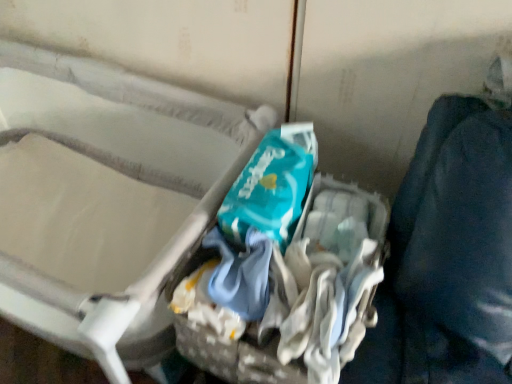
Question: Is point (378, 223) positioned closer to the camera than point (146, 175)?

Choices:
 (A) farther
 (B) closer

Answer: (B)

Question: From a real-world perspective, is teal fabric bag at center physically located above or below white fabric crib at upper left?

Choices:
 (A) below
 (B) above

Answer: (B)

Question: In terms of size, does teal fabric bag at center appear bigger or smaller than white fabric crib at upper left?

Choices:
 (A) big
 (B) small

Answer: (B)

Question: Is white fabric crib at upper left in front of or behind teal fabric bag at center in the image?

Choices:
 (A) behind
 (B) front

Answer: (B)

Question: From a real-world perspective, is white fabric crib at upper left physically located above or below teal fabric bag at center?

Choices:
 (A) above
 (B) below

Answer: (B)

Question: Is point (186, 104) positioned closer to the camera than point (308, 375)?

Choices:
 (A) closer
 (B) farther

Answer: (B)

Question: Is white fabric crib at upper left bigger or smaller than teal fabric bag at center?

Choices:
 (A) small
 (B) big

Answer: (B)